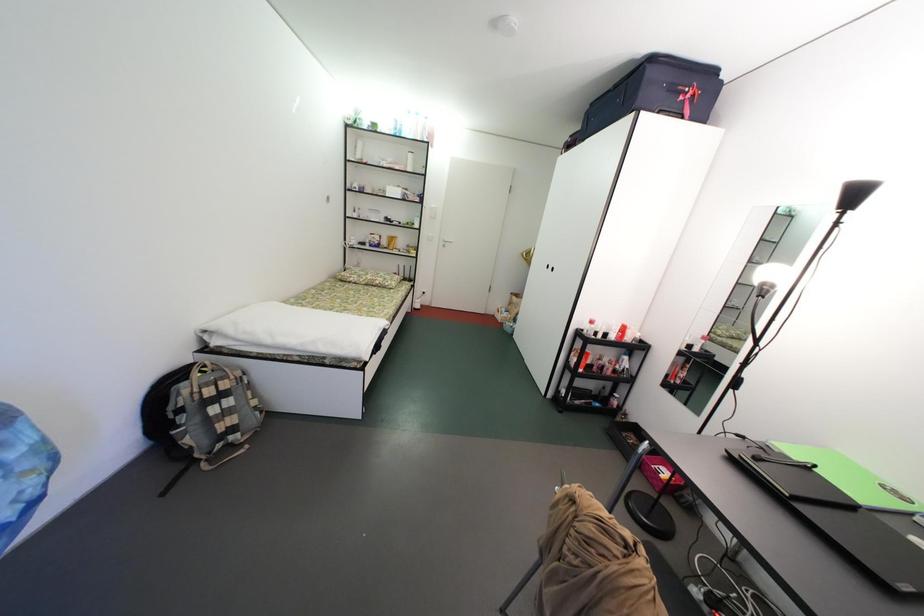
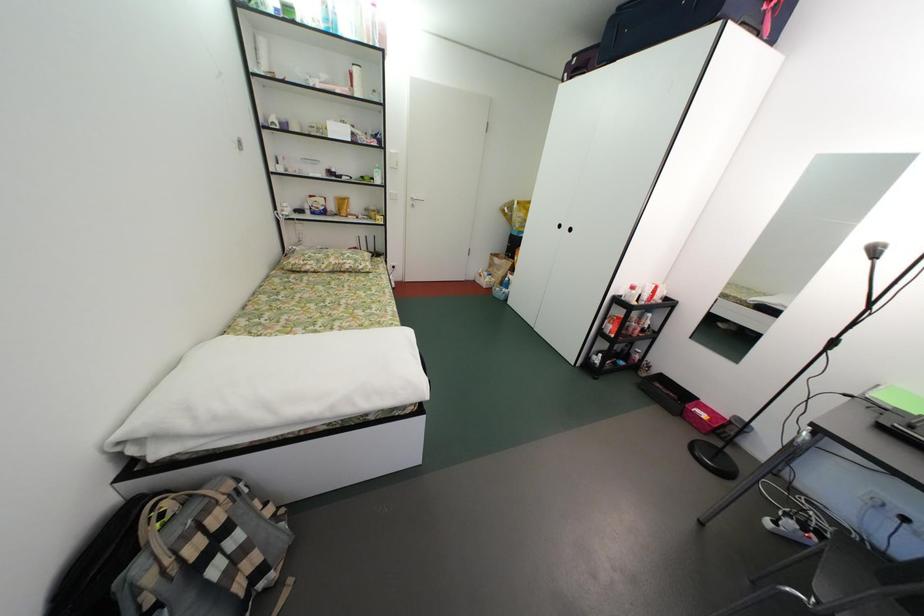
In a continuous first-person perspective shot, in which direction is the camera moving?

The cameraman moved toward left, forward.